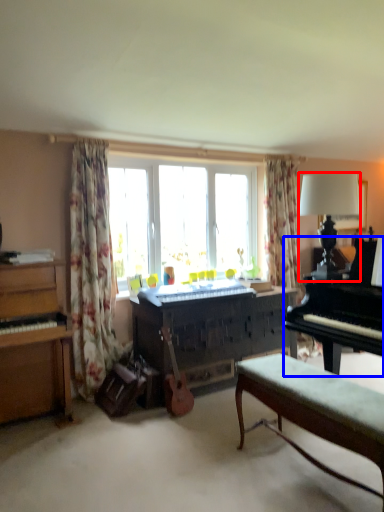
Question: Which point is closer to the camera, lamp (highlighted by a red box) or piano (highlighted by a blue box)?

Choices:
 (A) lamp
 (B) piano

Answer: (B)